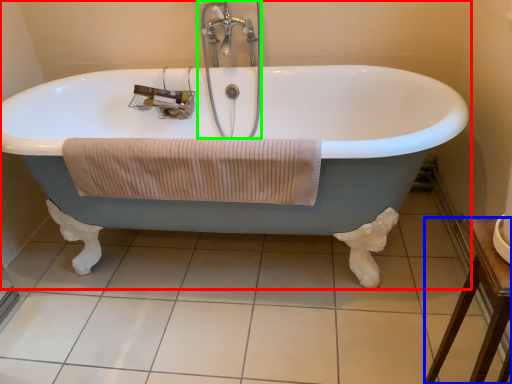
Question: Estimate the real-world distances between objects in this image. Which object is farther from bathtub (highlighted by a red box), furniture (highlighted by a blue box) or faucet (highlighted by a green box)?

Choices:
 (A) furniture
 (B) faucet

Answer: (A)